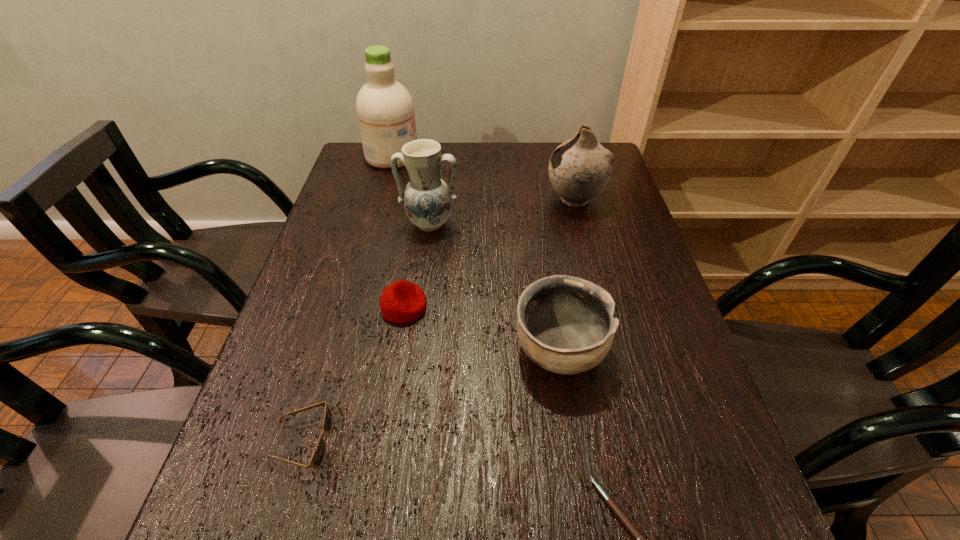
Where is `vacant space located on the back of the fourth tallest object`? vacant space located on the back of the fourth tallest object is located at coordinates (547, 274).

This screenshot has width=960, height=540. In order to click on vacant space located on the seat area of the beanbag in this screenshot , I will do `click(481, 307)`.

What are the coordinates of `free space located on the frames of the sixth tallest object` in the screenshot? It's located at (530, 442).

Find the location of `object at the far edge`. object at the far edge is located at coordinates (385, 110).

You are a GUI agent. You are given a task and a screenshot of the screen. Output one action in this format:
    pyautogui.click(x=<x>, y=<y>)
    Task: Click on the cleansing agent positioned at the left edge
    This screenshot has height=540, width=960.
    Given the screenshot: What is the action you would take?
    385,110

Image resolution: width=960 pixels, height=540 pixels. I want to click on sunglasses situated at the left edge, so click(318, 456).

In order to click on object present at the right edge in this screenshot , I will do `click(579, 169)`.

Identify the location of object positioned at the far left corner. The height and width of the screenshot is (540, 960). (385, 110).

Where is `blank space at the far edge of the desktop`? Image resolution: width=960 pixels, height=540 pixels. blank space at the far edge of the desktop is located at coordinates (546, 146).

Where is `free space at the left edge of the desktop`? This screenshot has width=960, height=540. free space at the left edge of the desktop is located at coordinates (357, 267).